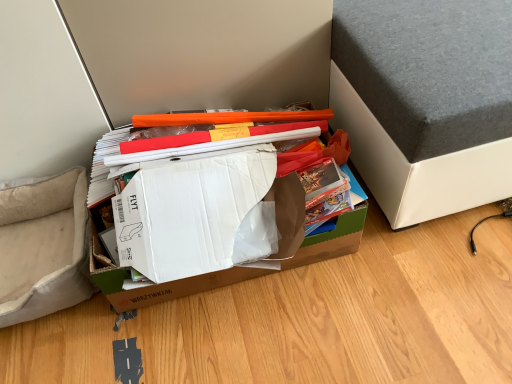
Where is `unoccupied area in front of brown cardboard box at center`? unoccupied area in front of brown cardboard box at center is located at coordinates (263, 342).